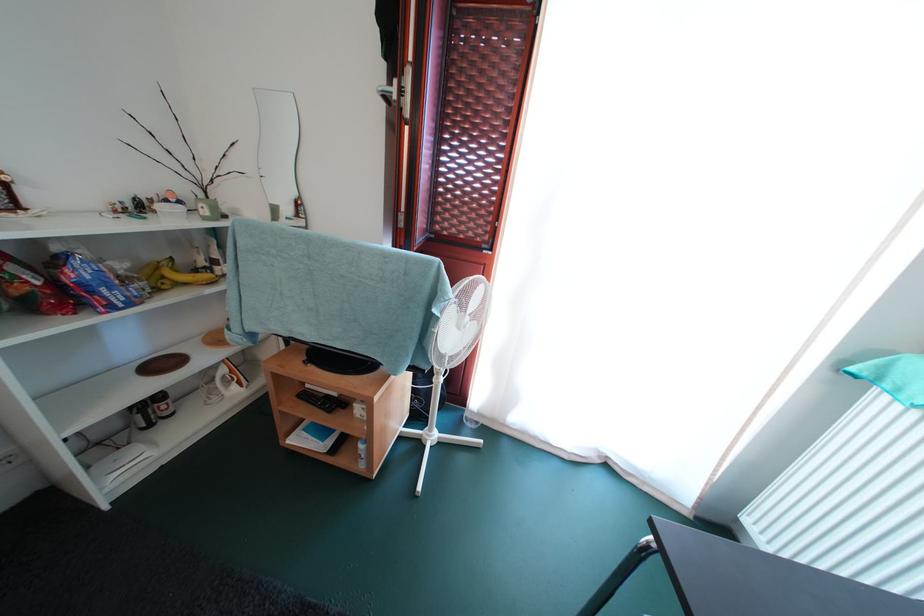
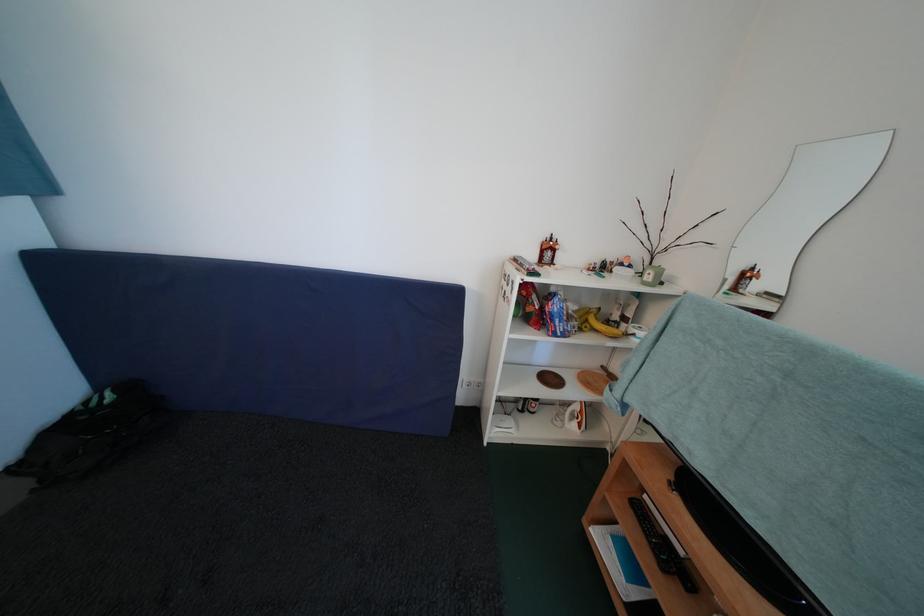
Question: I am providing you with two images of the same scene from different viewpoints. Which of the following objects are not visible in image2?

Choices:
 (A) red beer can
 (B) white iron handle
 (C) white mug handle
 (D) none of these

Answer: (D)